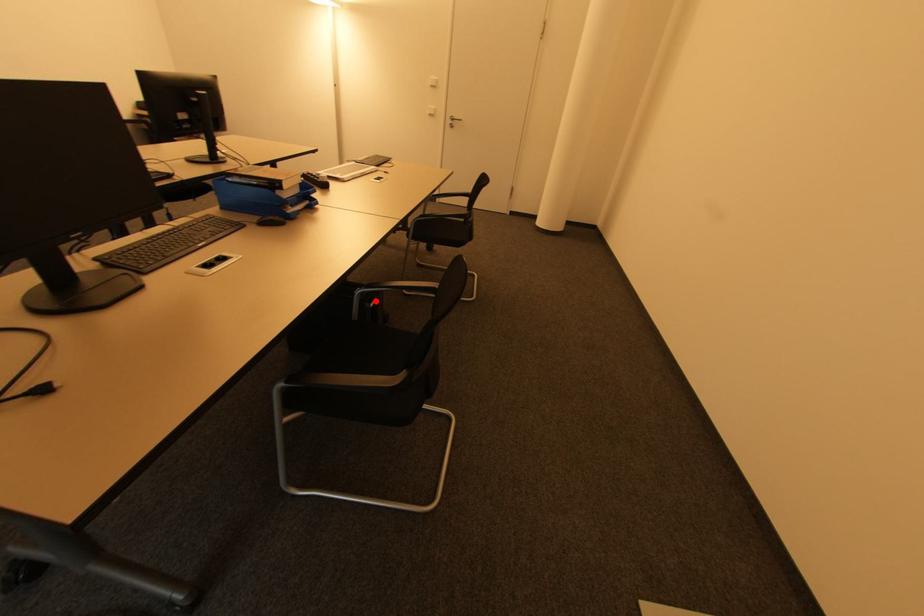
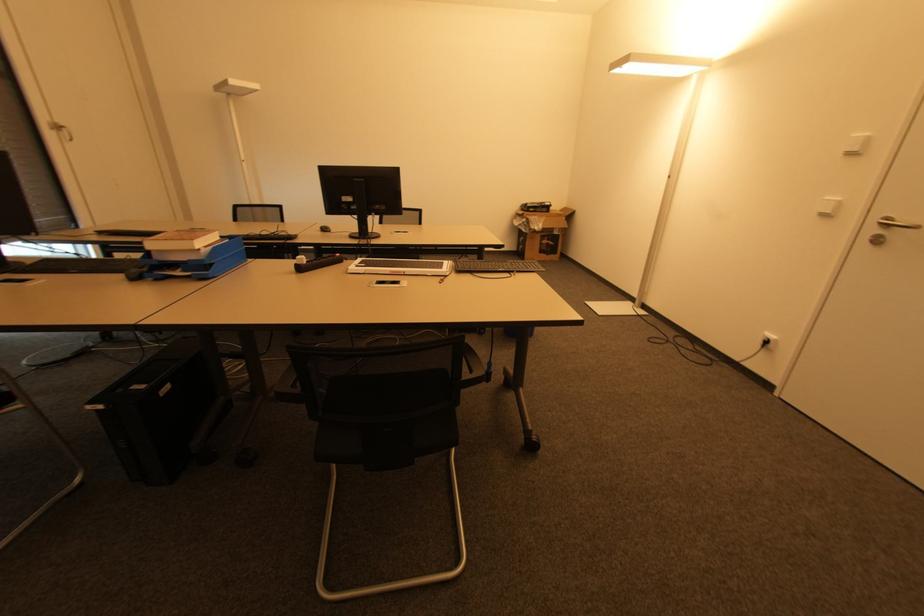
Find the pixel in the second image that matches the highlighted location in the first image.

(101, 408)